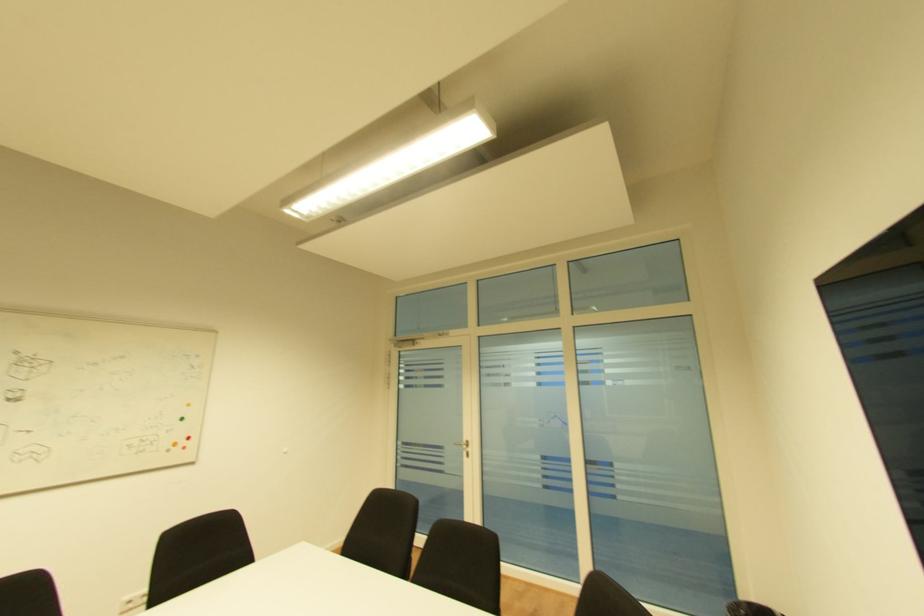
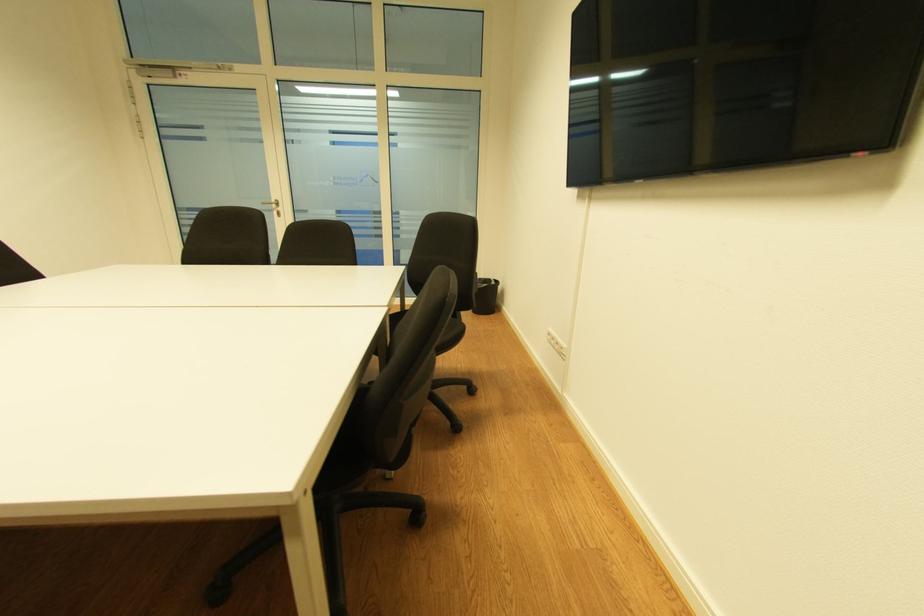
First-person continuous shooting, in which direction is the camera rotating?

The camera's rotation is toward right-down.